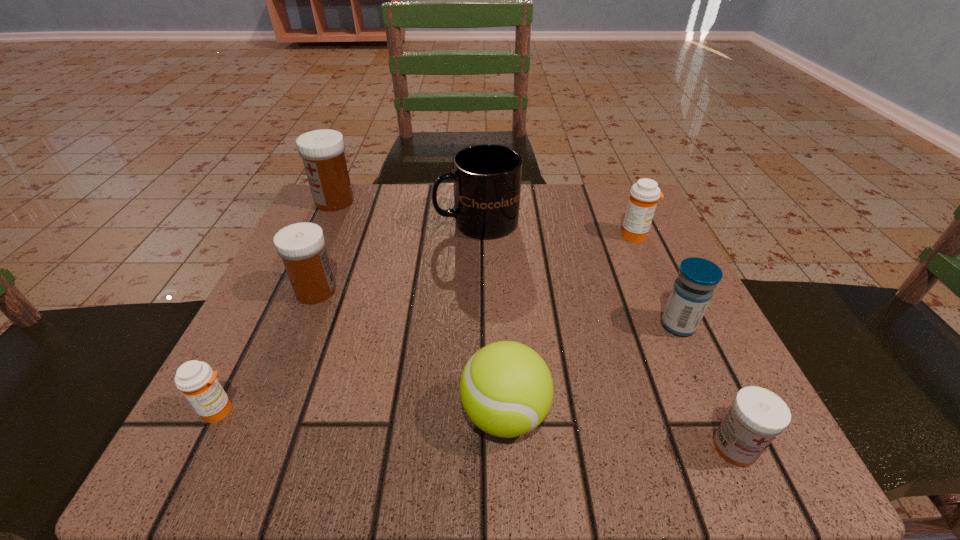
This screenshot has height=540, width=960. Find the location of `vacant area at the far edge of the desktop`. vacant area at the far edge of the desktop is located at coordinates (378, 246).

In the image, there is a desktop. Where is `free region at the left edge`? The image size is (960, 540). free region at the left edge is located at coordinates (270, 333).

You are a GUI agent. You are given a task and a screenshot of the screen. Output one action in this format:
    pyautogui.click(x=<x>, y=<y>)
    Task: Click on the blank space at the right edge of the desktop
    The width and height of the screenshot is (960, 540).
    Given the screenshot: What is the action you would take?
    pyautogui.click(x=665, y=301)

Identify the location of free region at the near left corner of the desktop. The image size is (960, 540). (257, 441).

Find the location of a particular element. This screenshot has width=960, height=540. free spot at the near right corner of the desktop is located at coordinates (674, 415).

Where is `empty space between the nearest white medicine and the tallest medicine`? This screenshot has width=960, height=540. empty space between the nearest white medicine and the tallest medicine is located at coordinates click(x=535, y=324).

The height and width of the screenshot is (540, 960). In order to click on vacant area that lies between the fifth farthest medicine and the farthest white medicine in this screenshot , I will do `click(276, 306)`.

Locate an element on the screen. Image resolution: width=960 pixels, height=540 pixels. free space between the blue medicine and the smallest white medicine is located at coordinates (707, 386).

Identify the location of vacant space that's between the second biggest white medicine and the third nearest medicine. This screenshot has height=540, width=960. (497, 308).

Where is `vacant area that lies between the black mug and the farthest white medicine`? vacant area that lies between the black mug and the farthest white medicine is located at coordinates (405, 212).